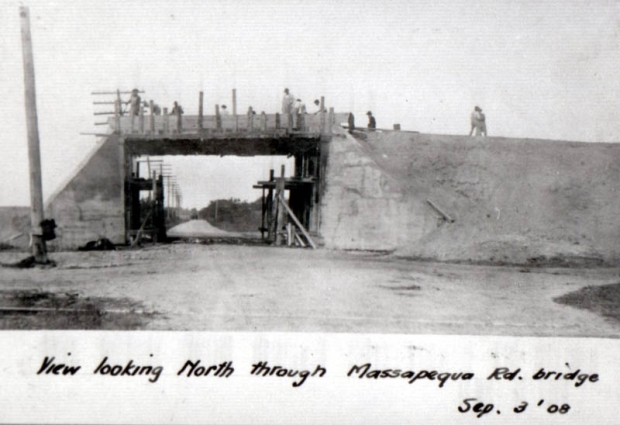
You are a GUI agent. You are given a task and a screenshot of the screen. Output one action in this format:
    pyautogui.click(x=<x>, y=<y>)
    Task: Click on the stairs
    This screenshot has width=620, height=425.
    Given the screenshot: What is the action you would take?
    pyautogui.click(x=99, y=174)